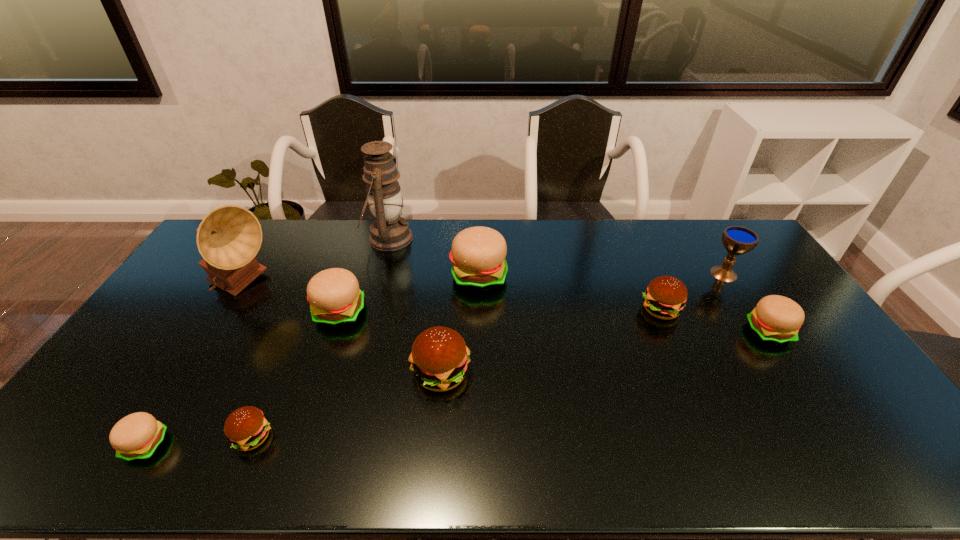
At what (x,y) coordinates should I click in order to perform the action: click on vacant space situated on the left of the chalice. Please return your answer as a coordinate pair (x, y). The height and width of the screenshot is (540, 960). Looking at the image, I should click on (658, 274).

This screenshot has width=960, height=540. Find the location of `vacant region located 0.330m on the right of the third nearest object`. vacant region located 0.330m on the right of the third nearest object is located at coordinates (590, 374).

Where is `vacant region located on the front of the second biggest beige hamburger`? The height and width of the screenshot is (540, 960). vacant region located on the front of the second biggest beige hamburger is located at coordinates (300, 431).

Find the location of `vacant region located on the left of the eighth object from left to right`. vacant region located on the left of the eighth object from left to right is located at coordinates (562, 309).

The image size is (960, 540). What are the coordinates of `vacant space located on the left of the third biggest beige hamburger` in the screenshot? It's located at (668, 332).

I want to click on blank space located 0.280m on the left of the nearest brown hamburger, so point(117,437).

Image resolution: width=960 pixels, height=540 pixels. What are the coordinates of `vacant space located 0.100m on the right of the leftmost hamburger` in the screenshot? It's located at (207, 444).

The height and width of the screenshot is (540, 960). In order to click on object located in the far edge section of the desktop in this screenshot , I will do `click(389, 232)`.

This screenshot has width=960, height=540. What are the coordinates of `object located in the left edge section of the desktop` in the screenshot? It's located at (229, 237).

This screenshot has height=540, width=960. Identify the location of chalice present at the right edge. (737, 240).